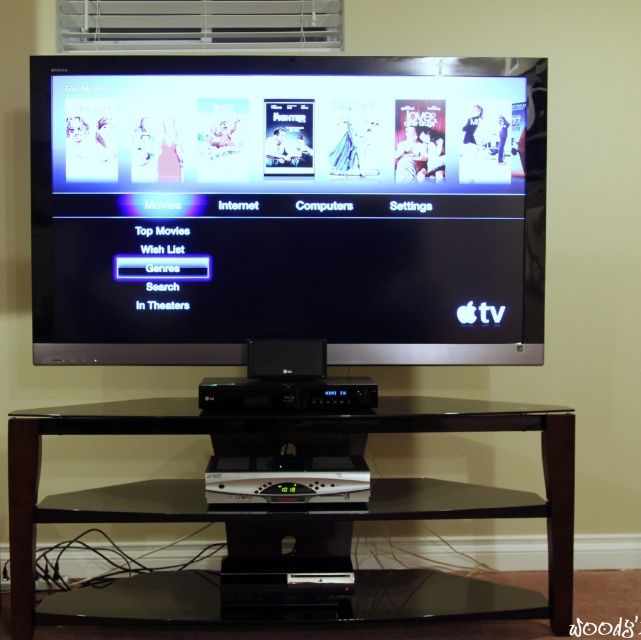
You are setting up a new TV mount and need to ensure it can support both the black glossy screen at upper center and the black glass table at center. Based on their sizes, which one requires a stronger mount?

The black glass table at center requires a stronger mount because it is larger than the black glossy screen at upper center.

Looking at this image, you are setting up a new remote control that needs to be placed on the black glass table at center. To ensure it doesn not interfere with the TV, where should you position it relative to the black glossy screen at upper center?

The black glossy screen at upper center is above the black glass table at center, so placing the remote control on the black glass table at center below the black glossy screen at upper center will ensure it does not interfere with the TV.

You are setting up a new remote control and need to align it with the black glossy screen at upper center and the black glass table at center. According to the scene, which object is located to the right of the other?

The black glossy screen at upper center is positioned on the right side of black glass table at center.